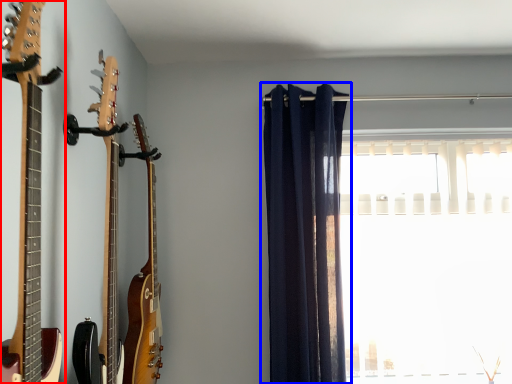
Question: Which point is closer to the camera, guitar (highlighted by a red box) or curtain (highlighted by a blue box)?

Choices:
 (A) guitar
 (B) curtain

Answer: (A)